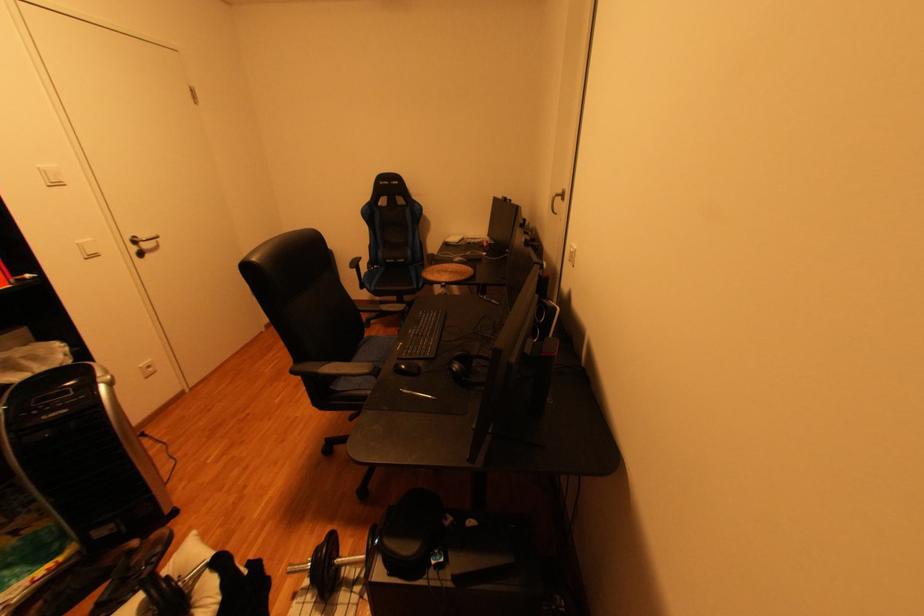
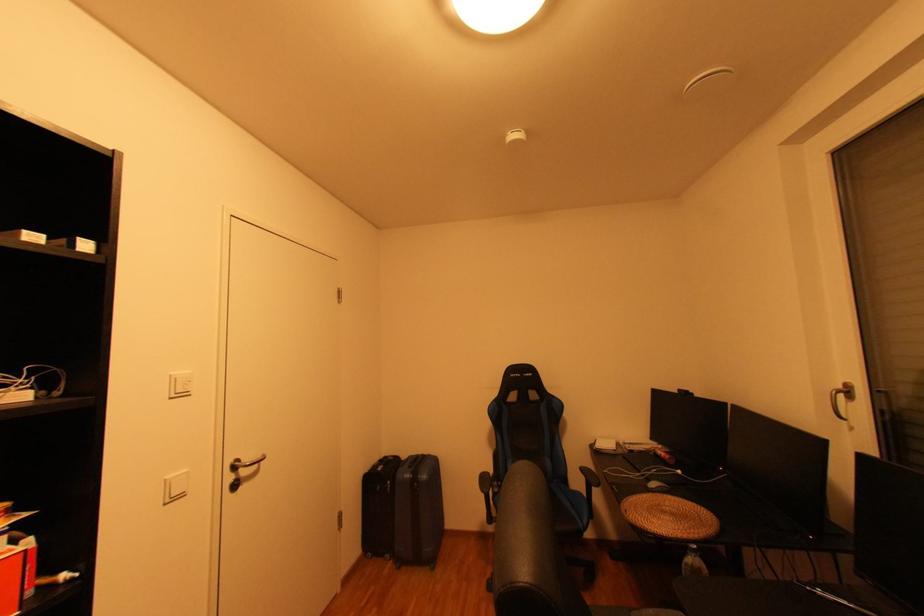
Where in the second image is the point corresponding to [569,193] from the first image?

(849, 387)